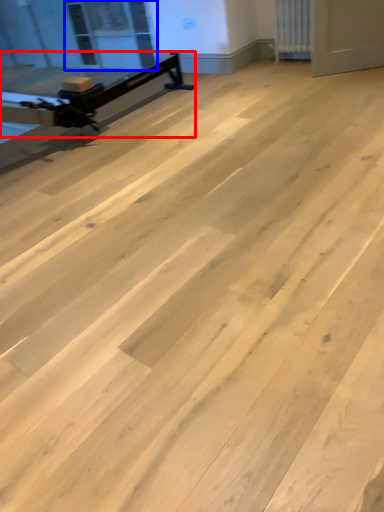
Question: Which point is closer to the camera, furniture (highlighted by a red box) or window screen (highlighted by a blue box)?

Choices:
 (A) furniture
 (B) window screen

Answer: (A)